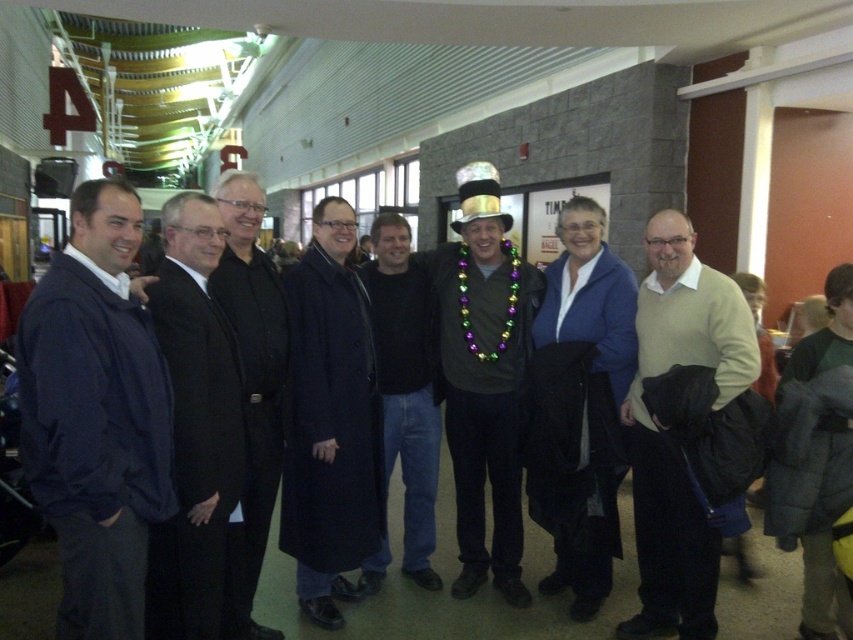
You are organizing a clothing donation drive and need to determine if the dark blue wool coat at center and the dark blue jeans at center can fit into a standard donation box that has a maximum capacity of 1 cubic foot. Which item is more likely to fit based on their sizes?

The dark blue wool coat at center is smaller than the dark blue jeans at center, so it is more likely to fit into the standard donation box with a 1 cubic foot capacity.

You are a photographer trying to adjust the lighting for a group photo. You notice the dark blue wool coat at center and the dark blue jeans at center. Which one is positioned higher in the image?

The dark blue wool coat at center is above dark blue jeans at center, so the dark blue wool coat at center is positioned higher in the image.

You are a photographer adjusting the camera focus. The shiny metallic top hat at center and dark blue jeans at center are both in the frame. Which object should you focus on first if you want to ensure both are in focus simultaneously?

You should focus on the shiny metallic top hat at center first because it is closer to the camera than the dark blue jeans at center, ensuring both will be in focus when focusing on the closer object.